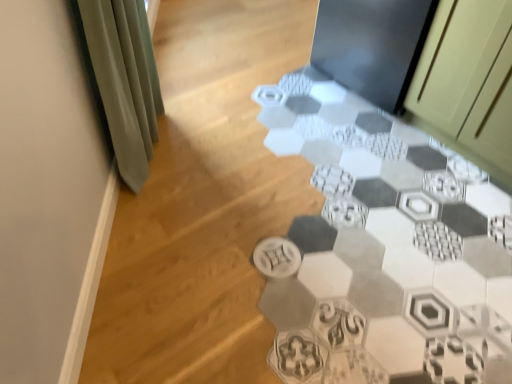
Image resolution: width=512 pixels, height=384 pixels. Identify the location of patterned ceramic tile at center. (385, 250).

Measure the distance between patterned ceramic tile at center and camera.

patterned ceramic tile at center is 1.26 meters away from camera.

This screenshot has height=384, width=512. Describe the element at coordinates (385, 250) in the screenshot. I see `patterned ceramic tile at center` at that location.

Identify the location of patterned ceramic tile at center. (385, 250).